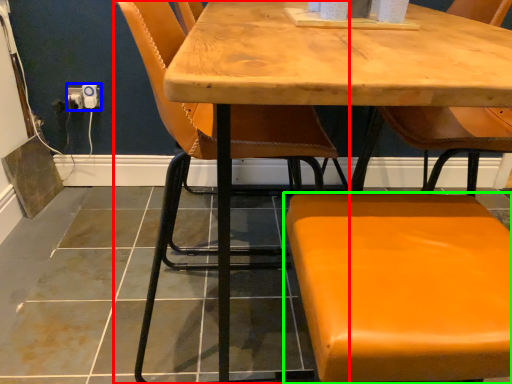
Question: Which object is the closest to the chair (highlighted by a red box)? Choose among these: electric outlet (highlighted by a blue box) or chair (highlighted by a green box).

Choices:
 (A) electric outlet
 (B) chair

Answer: (A)